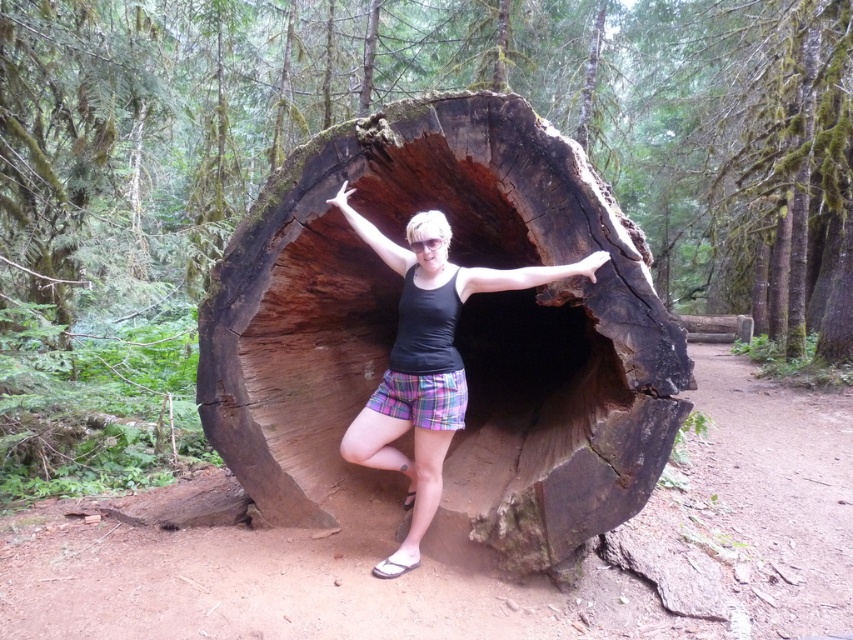
Which is behind, point (242, 432) or point (409, 237)?

Point (242, 432)

Does dark brown wood log at center have a smaller size compared to plaid shorts at center?

No, dark brown wood log at center is not smaller than plaid shorts at center.

This screenshot has width=853, height=640. In order to click on dark brown wood log at center in this screenshot , I will do `click(456, 333)`.